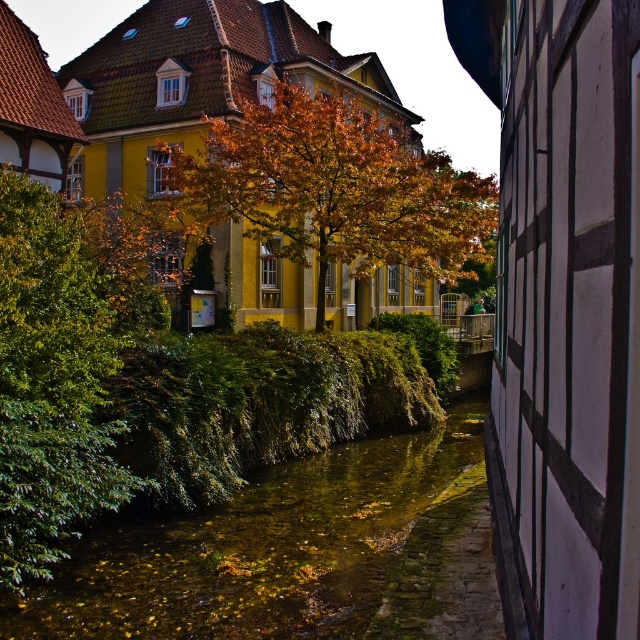
Question: Is green mossy water at center smaller than autumn leaves at center?

Choices:
 (A) yes
 (B) no

Answer: (A)

Question: Which is nearer to the green mossy water at center?

Choices:
 (A) green leafy tree at left
 (B) autumn leaves at center

Answer: (A)

Question: Does green mossy water at center appear on the left side of autumn leaves at center?

Choices:
 (A) no
 (B) yes

Answer: (B)

Question: Which point appears closest to the camera in this image?

Choices:
 (A) (371, 157)
 (B) (1, 328)

Answer: (B)

Question: In this image, where is green mossy water at center located relative to green leafy tree at left?

Choices:
 (A) right
 (B) left

Answer: (A)

Question: Which point appears closest to the camera in this image?

Choices:
 (A) (316, 520)
 (B) (35, 198)

Answer: (B)